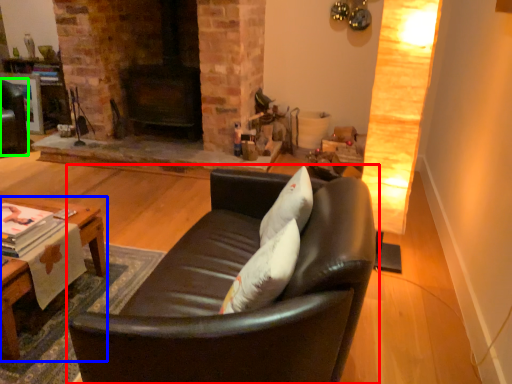
Question: Estimate the real-world distances between objects in this image. Which object is closer to studio couch (highlighted by a red box), table (highlighted by a blue box) or swivel chair (highlighted by a green box)?

Choices:
 (A) table
 (B) swivel chair

Answer: (A)